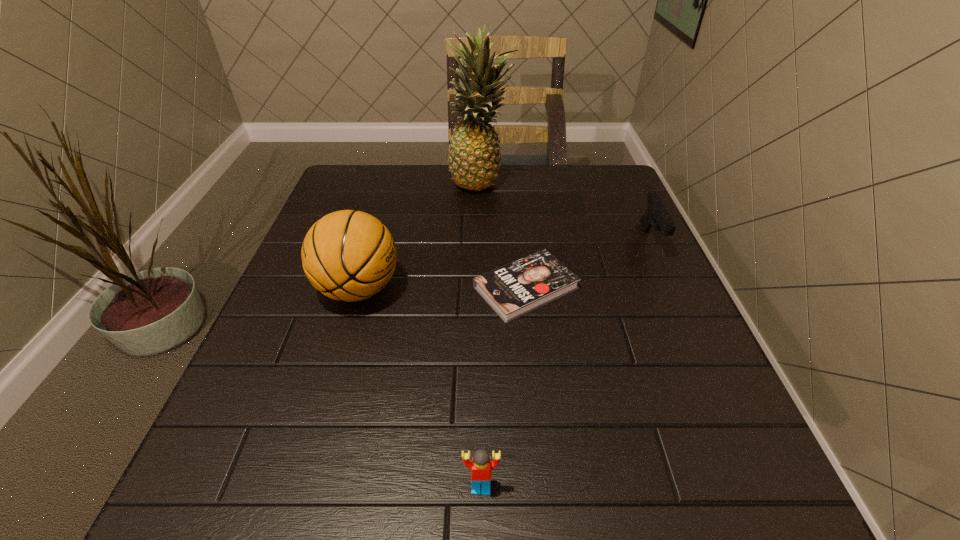
Identify the location of pineapple. This screenshot has width=960, height=540. (474, 157).

What are the coordinates of `the tallest object` in the screenshot? It's located at (474, 157).

Where is `the fourth shortest object`? the fourth shortest object is located at coordinates (346, 255).

Identify the location of the leftmost object. The height and width of the screenshot is (540, 960). (346, 255).

Locate an element on the screen. Image resolution: width=960 pixels, height=540 pixels. the rightmost object is located at coordinates (656, 215).

This screenshot has width=960, height=540. Identify the location of Lego. (481, 465).

This screenshot has width=960, height=540. I want to click on book, so click(513, 290).

I want to click on free region located 0.330m on the front of the tallest object, so click(x=482, y=281).

I want to click on vacant space located 0.160m on the surface of the leftmost object near the brand logo, so click(478, 289).

This screenshot has width=960, height=540. I want to click on free space located 0.130m on the front-facing side of the pistol, so click(680, 304).